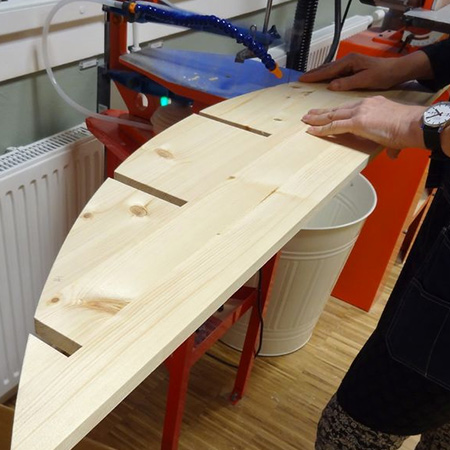
Find the location of a particular element. Image resolution: width=450 pixels, height=450 pixels. trashcan is located at coordinates (323, 240).